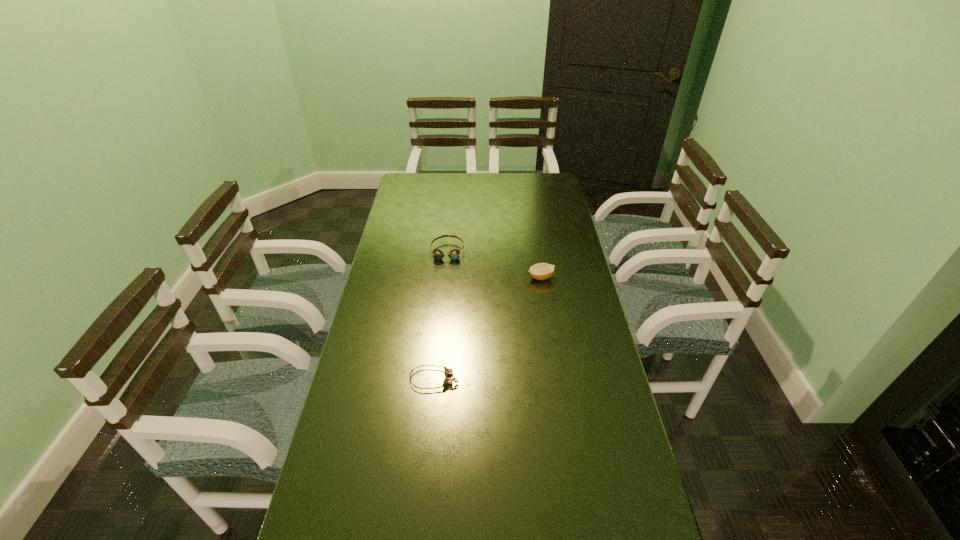
Locate an element on the screen. free space at the far edge is located at coordinates (473, 193).

Identify the location of vacant space at the left edge of the desktop. (362, 321).

You are a GUI agent. You are given a task and a screenshot of the screen. Output one action in this format:
    pyautogui.click(x=<x>, y=<y>)
    Task: Click on the free region at the right edge of the desktop
    The width and height of the screenshot is (960, 540).
    Given the screenshot: What is the action you would take?
    click(554, 342)

You are a GUI agent. You are given a task and a screenshot of the screen. Output one action in this format:
    pyautogui.click(x=<x>, y=<y>)
    Task: Click on the free region at the far left corner of the desktop
    The width and height of the screenshot is (960, 540).
    Given the screenshot: What is the action you would take?
    pyautogui.click(x=413, y=179)

At what (x,y) coordinates should I click in order to perform the action: click on free space at the far right corner. Please return your answer as a coordinate pair (x, y). The height and width of the screenshot is (540, 960). Looking at the image, I should click on (539, 184).

At what (x,y) coordinates should I click in order to perform the action: click on vacant area that lies between the farther goggles and the second farthest object. Please return your answer as a coordinate pair (x, y). Looking at the image, I should click on click(x=494, y=264).

Locate an element on the screen. This screenshot has width=960, height=540. vacant space in between the rightmost object and the farther goggles is located at coordinates (494, 264).

Identify the location of blank region between the shortest object and the farther goggles. This screenshot has width=960, height=540. (441, 315).

The width and height of the screenshot is (960, 540). I want to click on vacant area between the second farthest object and the farther goggles, so click(x=494, y=264).

This screenshot has height=540, width=960. I want to click on vacant area between the lemon and the farthest object, so click(x=494, y=264).